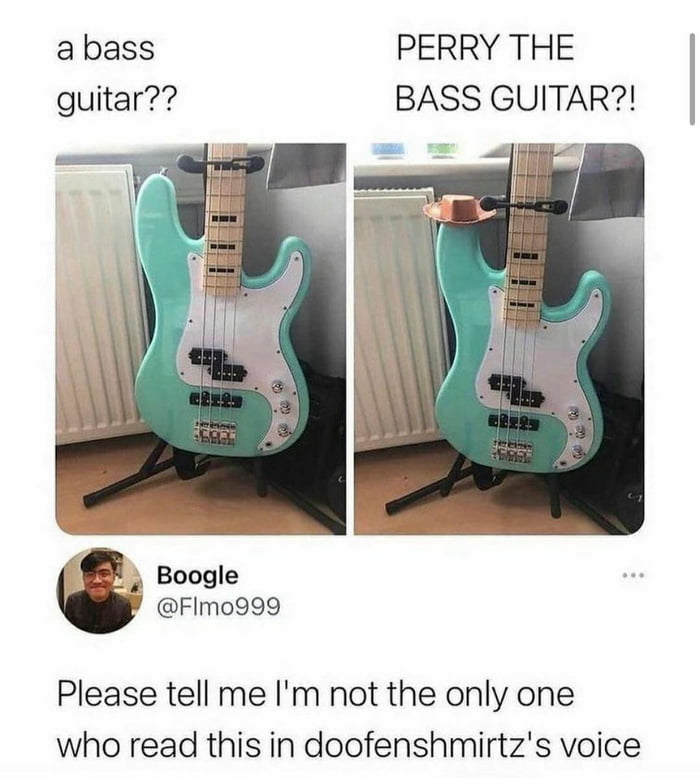
At what (x,y) coordinates should I click in order to perform the action: click on handle. Please return your answer as a coordinate pair (x, y). The image size is (700, 778). Looking at the image, I should click on (178, 615).